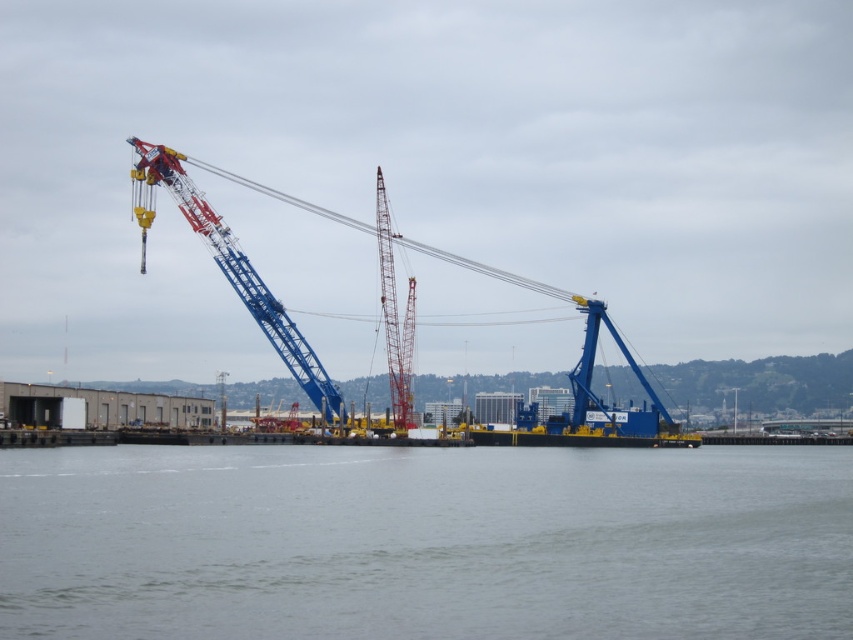
Can you confirm if gray water at center is smaller than blue metallic crane at center?

Yes.

Consider the image. Between gray water at center and blue metallic crane at center, which one is positioned higher?

blue metallic crane at center

This screenshot has height=640, width=853. What are the coordinates of `gray water at center` in the screenshot? It's located at (425, 541).

At what (x,y) coordinates should I click in order to perform the action: click on gray water at center. Please return your answer as a coordinate pair (x, y). The image size is (853, 640). Looking at the image, I should click on (425, 541).

Who is positioned more to the right, gray water at center or metallic blue crane at center?

gray water at center is more to the right.

What do you see at coordinates (425, 541) in the screenshot? I see `gray water at center` at bounding box center [425, 541].

This screenshot has height=640, width=853. What are the coordinates of `gray water at center` in the screenshot? It's located at (425, 541).

Which is above, blue metallic crane at center or metallic blue crane at center?

Positioned higher is metallic blue crane at center.

Does point (576, 435) lie behind point (305, 390)?

Yes, point (576, 435) is farther from viewer.

At what (x,y) coordinates should I click in order to perform the action: click on blue metallic crane at center. Please return your answer as a coordinate pair (x, y). Looking at the image, I should click on (596, 406).